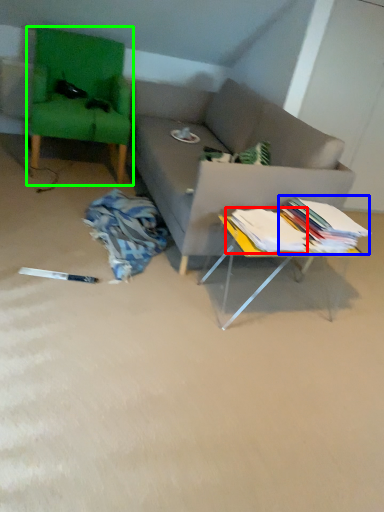
Question: Which is farther away from book (highlighted by a red box)? book (highlighted by a blue box) or swivel chair (highlighted by a green box)?

Choices:
 (A) book
 (B) swivel chair

Answer: (B)